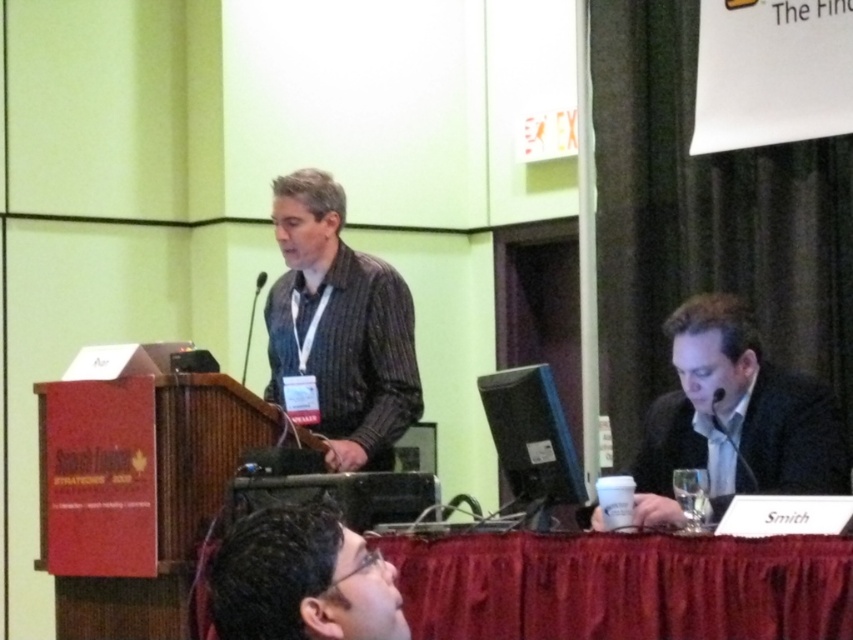
Question: Does smooth fabric tablecloth at lower center have a greater width compared to striped fabric shirt at left?

Choices:
 (A) yes
 (B) no

Answer: (A)

Question: Is the position of black suit at right less distant than that of matte black glasses at lower center?

Choices:
 (A) no
 (B) yes

Answer: (A)

Question: Among these objects, which one is farthest from the camera?

Choices:
 (A) striped fabric shirt at left
 (B) matte black glasses at lower center
 (C) black suit at right
 (D) smooth fabric tablecloth at lower center

Answer: (A)

Question: Which point appears farthest from the camera in this image?

Choices:
 (A) (268, 611)
 (B) (757, 445)
 (C) (822, 600)
 (D) (349, 257)

Answer: (D)

Question: Observing the image, what is the correct spatial positioning of striped fabric shirt at left in reference to matte black glasses at lower center?

Choices:
 (A) right
 (B) left

Answer: (B)

Question: Which point is farther to the camera?

Choices:
 (A) (831, 550)
 (B) (312, 586)
 (C) (814, 429)

Answer: (C)